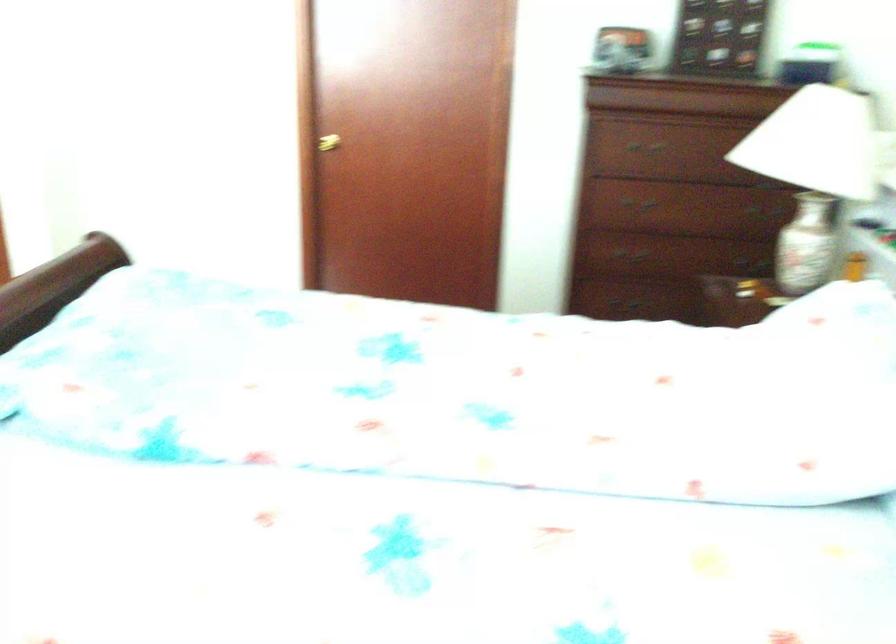
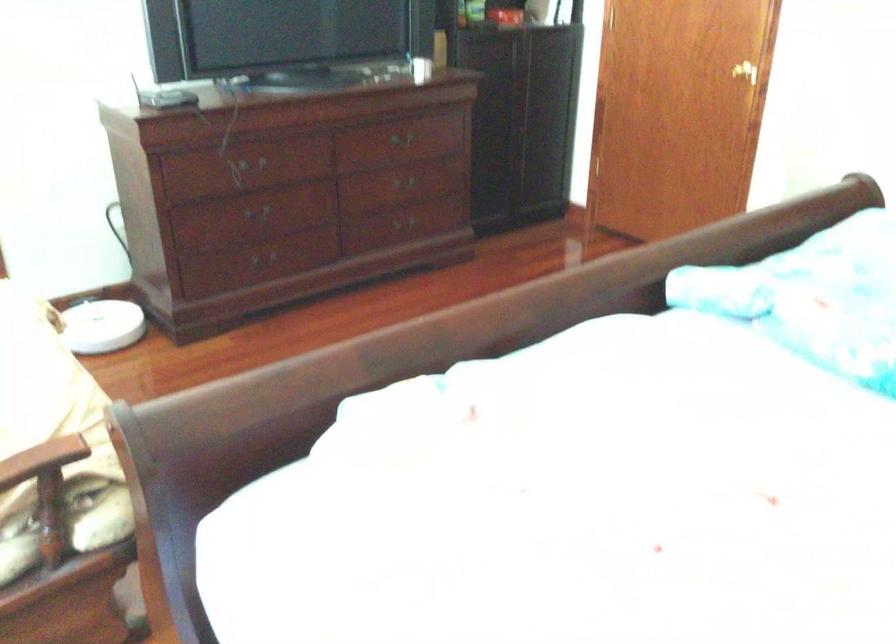
Question: Based on the continuous images, in which direction is the camera rotating? Reply with the corresponding letter.

Choices:
 (A) Left
 (B) Right
 (C) Up
 (D) Down

Answer: (A)